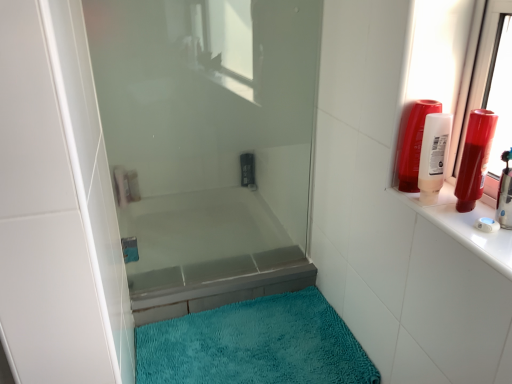
Question: From the image's perspective, would you say teal plush bath mat at lower center is positioned over shiny red tube at upper right, the 6th toiletry viewed from the left?

Choices:
 (A) yes
 (B) no

Answer: (B)

Question: From the image's perspective, is teal plush bath mat at lower center located beneath shiny red tube at upper right, arranged as the 1th toiletry when viewed from the front?

Choices:
 (A) no
 (B) yes

Answer: (B)

Question: Is teal plush bath mat at lower center shorter than shiny red tube at upper right, arranged as the 1th toiletry when viewed from the front?

Choices:
 (A) no
 (B) yes

Answer: (B)

Question: Is teal plush bath mat at lower center far from shiny red tube at upper right, arranged as the 1th toiletry when viewed from the front?

Choices:
 (A) no
 (B) yes

Answer: (A)

Question: Is teal plush bath mat at lower center further to the viewer compared to shiny red tube at upper right, the 6th toiletry from the back?

Choices:
 (A) no
 (B) yes

Answer: (B)

Question: From the image's perspective, is transparent glass shower door at center located above or below translucent plastic shampoo bottle at upper right, which is the fourth toiletry from back to front?

Choices:
 (A) above
 (B) below

Answer: (B)

Question: Considering their positions, is transparent glass shower door at center located in front of or behind translucent plastic shampoo bottle at upper right, which is the 3th toiletry from right to left?

Choices:
 (A) behind
 (B) front

Answer: (A)

Question: Does point (207, 193) appear closer or farther from the camera than point (409, 178)?

Choices:
 (A) closer
 (B) farther

Answer: (B)

Question: Which is correct: transparent glass shower door at center is inside translucent plastic shampoo bottle at upper right, which is the 3th toiletry from right to left, or outside of it?

Choices:
 (A) inside
 (B) outside

Answer: (B)

Question: From their relative heights in the image, would you say transparent glass shower door at center is taller or shorter than shiny red tube at upper right, the 6th toiletry from the back?

Choices:
 (A) tall
 (B) short

Answer: (A)

Question: Is transparent glass shower door at center inside the boundaries of shiny red tube at upper right, positioned as the 1th toiletry in right-to-left order, or outside?

Choices:
 (A) outside
 (B) inside

Answer: (A)

Question: In terms of width, does transparent glass shower door at center look wider or thinner when compared to shiny red tube at upper right, the 6th toiletry viewed from the left?

Choices:
 (A) wide
 (B) thin

Answer: (B)

Question: Is point (208, 135) positioned closer to the camera than point (470, 165)?

Choices:
 (A) closer
 (B) farther

Answer: (B)

Question: Is shiny red tube at upper right, the 6th toiletry from the back, bigger or smaller than transparent glass shower door at center?

Choices:
 (A) big
 (B) small

Answer: (B)

Question: From a real-world perspective, is shiny red tube at upper right, arranged as the 1th toiletry when viewed from the front, physically located above or below transparent glass shower door at center?

Choices:
 (A) below
 (B) above

Answer: (B)